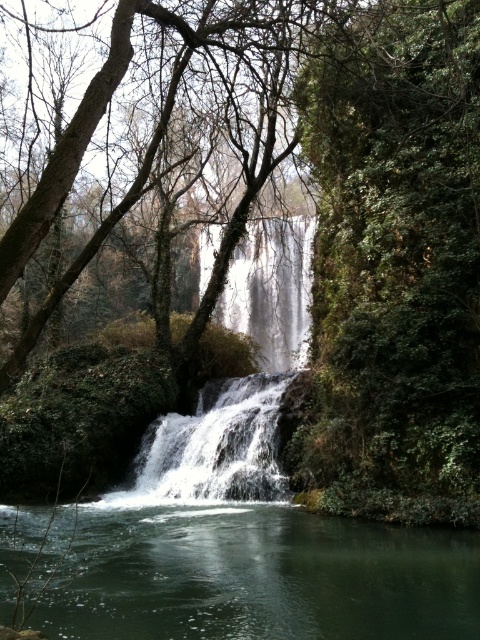
Is clear water at center below white frothy water at center?

Yes.

Between clear water at center and white frothy water at center, which one has less height?

clear water at center

The height and width of the screenshot is (640, 480). Find the location of `clear water at center`. clear water at center is located at coordinates (257, 577).

Can you confirm if green leafy tree at center is bigger than white frothy water at center?

Yes.

Is point (386, 266) in front of point (160, 456)?

Yes, it is.

Between point (359, 125) and point (236, 413), which one is positioned in front?

Point (359, 125) is in front.

The image size is (480, 640). Identify the location of green leafy tree at center. (395, 264).

Does green leafy tree at center appear on the right side of clear water at center?

Indeed, green leafy tree at center is positioned on the right side of clear water at center.

Can you confirm if green leafy tree at center is shorter than clear water at center?

No, green leafy tree at center is not shorter than clear water at center.

Describe the element at coordinates (395, 264) in the screenshot. I see `green leafy tree at center` at that location.

Find the location of a particular element. The height and width of the screenshot is (640, 480). green leafy tree at center is located at coordinates (395, 264).